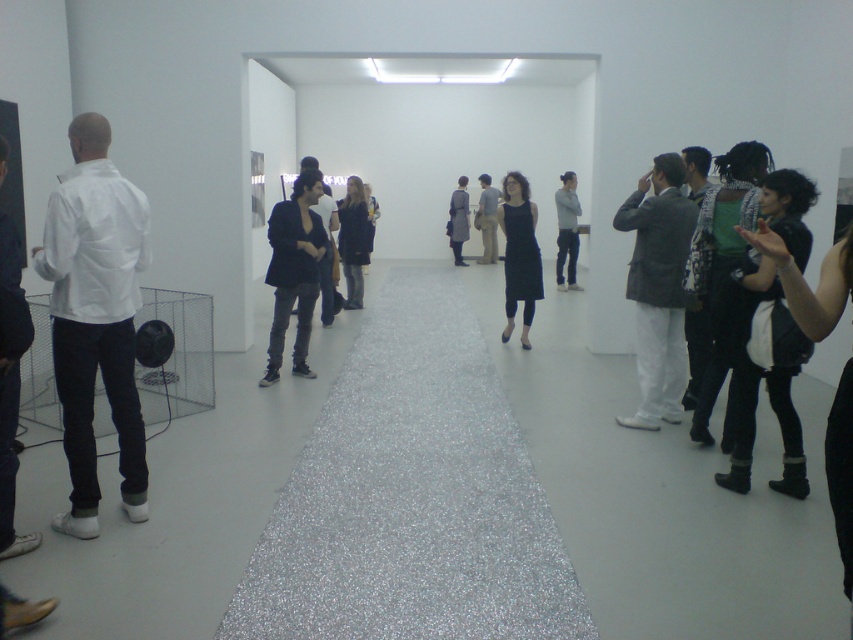
Between gray suit at right and matte white shirt at left, which one is positioned higher?

gray suit at right is above.

Does gray suit at right appear on the right side of matte white shirt at left?

Indeed, gray suit at right is positioned on the right side of matte white shirt at left.

Is point (686, 232) behind point (12, 276)?

Yes, point (686, 232) is farther from viewer.

This screenshot has height=640, width=853. I want to click on gray suit at right, so click(659, 289).

How much distance is there between black matte dress at center and gray cotton sweater at center?

The distance of black matte dress at center from gray cotton sweater at center is 3.56 meters.

Is black matte dress at center behind gray cotton sweater at center?

No.

Which is behind, point (515, 301) or point (561, 256)?

Point (561, 256)

This screenshot has height=640, width=853. I want to click on black matte dress at center, so click(x=519, y=253).

Which of these two, matte white shirt at left or gray wool coat at center, stands taller?

matte white shirt at left is taller.

Does matte white shirt at left have a greater width compared to gray wool coat at center?

No, matte white shirt at left is not wider than gray wool coat at center.

Does point (13, 266) come in front of point (451, 227)?

Yes, it is.

Locate an element on the screen. matte white shirt at left is located at coordinates (10, 467).